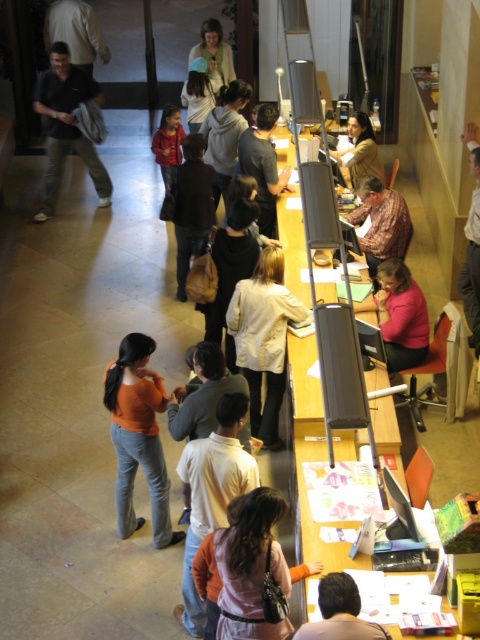
Question: Which point is closer to the camera?

Choices:
 (A) (370, 216)
 (B) (120, 474)

Answer: (B)

Question: Based on their relative distances, which object is nearer to the matte beige sweater at center?

Choices:
 (A) brown leather jacket at lower center
 (B) white matte jacket at center
 (C) wooden desk at center

Answer: (C)

Question: Is light brown shirt at center above brown leather jacket at lower center?

Choices:
 (A) no
 (B) yes

Answer: (B)

Question: Which of the following is the farthest from the observer?

Choices:
 (A) orange cotton shirt at center
 (B) brown leather jacket at lower center
 (C) plaid shirt at center
 (D) matte beige sweater at center

Answer: (D)

Question: Where is plaid shirt at center located in relation to brown leather jacket at lower center in the image?

Choices:
 (A) right
 (B) left

Answer: (A)

Question: From the image, what is the correct spatial relationship of orange sweater at center in relation to light brown leather jacket at center?

Choices:
 (A) above
 (B) below

Answer: (B)